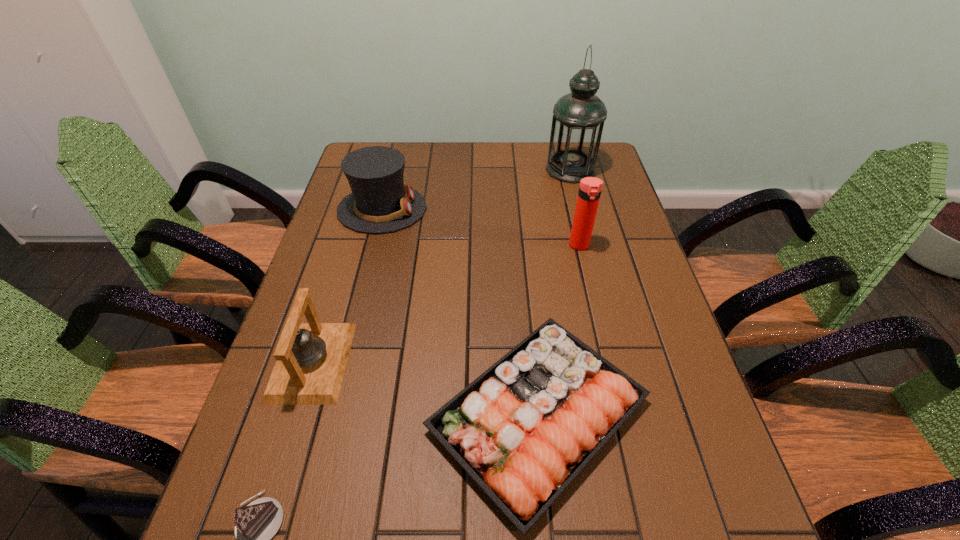
This screenshot has width=960, height=540. Identify the location of vacant space that's between the bell and the oil lamp. (442, 266).

Locate an element on the screen. vacant area that lies between the bell and the tallest object is located at coordinates (442, 266).

You are a GUI agent. You are given a task and a screenshot of the screen. Output one action in this format:
    pyautogui.click(x=<x>, y=<y>)
    Task: Click on the empty space between the dress hat and the thermos bottle
    The width and height of the screenshot is (960, 540).
    Given the screenshot: What is the action you would take?
    click(x=481, y=227)

The width and height of the screenshot is (960, 540). Identify the location of vacant space in between the thermos bottle and the dress hat. (481, 227).

Where is `blank region between the bell and the tallest object`? blank region between the bell and the tallest object is located at coordinates (442, 266).

Locate an element on the screen. This screenshot has height=540, width=960. the fifth closest object to the chocolate cake is located at coordinates (578, 118).

Where is `object that is the closest one to the dress hat`? Image resolution: width=960 pixels, height=540 pixels. object that is the closest one to the dress hat is located at coordinates (311, 358).

Locate an element on the screen. vacant space that satisfies the following two spatial constraints: 1. on the back side of the third farthest object; 2. on the right side of the farthest object is located at coordinates (562, 170).